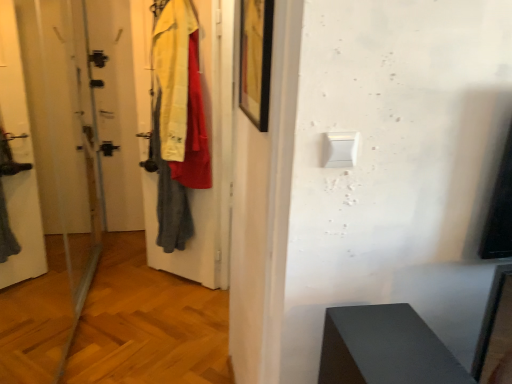
Question: Considering the relative positions of black matte picture frame at upper center and white plastic light switch at upper center in the image provided, is black matte picture frame at upper center to the left or to the right of white plastic light switch at upper center?

Choices:
 (A) right
 (B) left

Answer: (B)

Question: Is black matte picture frame at upper center bigger or smaller than white plastic light switch at upper center?

Choices:
 (A) big
 (B) small

Answer: (A)

Question: Based on their relative distances, which object is farther from the black matte picture frame at upper center?

Choices:
 (A) transparent glass screen door at left
 (B) white plastic light switch at upper center

Answer: (A)

Question: Which object is positioned closest to the white plastic light switch at upper center?

Choices:
 (A) black matte picture frame at upper center
 (B) transparent glass screen door at left

Answer: (A)